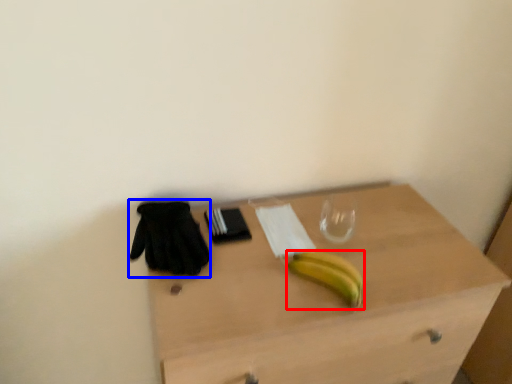
Question: Among these objects, which one is farthest to the camera, banana (highlighted by a red box) or glove (highlighted by a blue box)?

Choices:
 (A) banana
 (B) glove

Answer: (B)